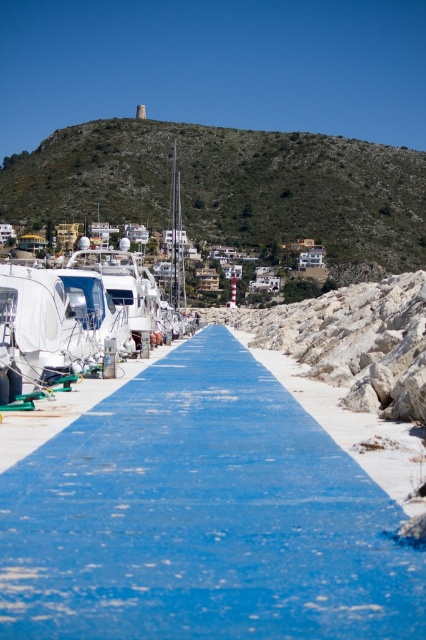
You are standing at the camera position and want to walk towards the two points marked in the image. Which point, point (175, 570) or point (40, 200), will you reach first?

Point (175, 570) is closer to the camera than point (40, 200), so you will reach point (175, 570) first.

Looking at this image, you are standing at the camera position looking at the coastal walkway. There are two points marked on the walkway. Which point, point (x=348, y=460) or point (x=104, y=280), is closer to you?

Point (x=348, y=460) is closer to the camera than point (x=104, y=280).